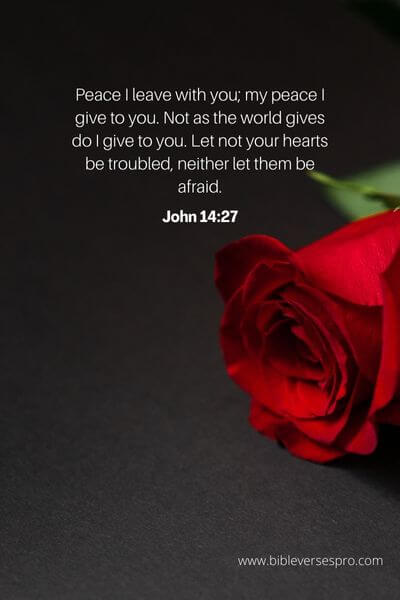
Identify the location of grey table. (223, 527), (101, 553), (181, 470), (186, 432), (82, 485).